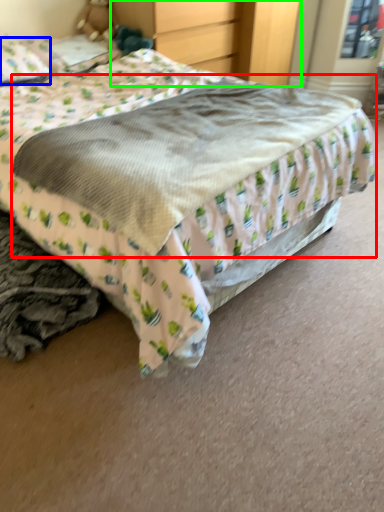
Question: Which is farther away from mattress (highlighted by a red box)? pillow (highlighted by a blue box) or dresser (highlighted by a green box)?

Choices:
 (A) pillow
 (B) dresser

Answer: (B)